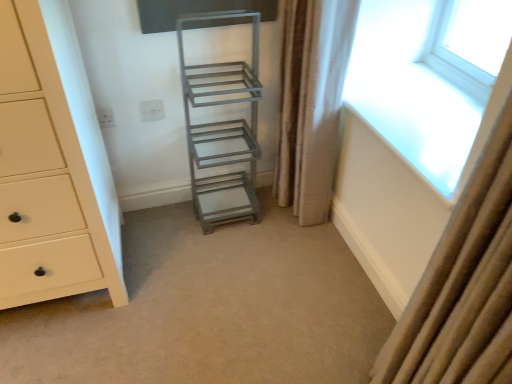
At what (x,y) coordinates should I click in order to perform the action: click on vacant space situated on the left part of metallic gray shelf at center. Please return your answer as a coordinate pair (x, y). This screenshot has width=512, height=384. Looking at the image, I should click on (167, 217).